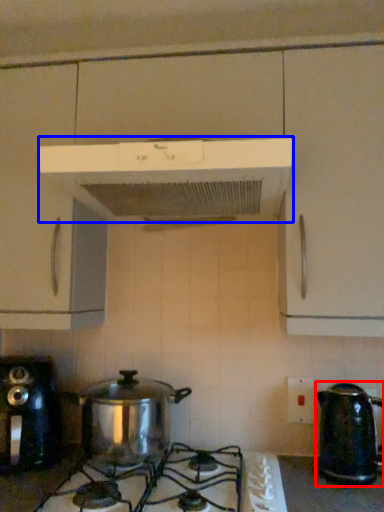
Question: Among these objects, which one is nearest to the camera, kettle (highlighted by a red box) or home appliance (highlighted by a blue box)?

Choices:
 (A) kettle
 (B) home appliance

Answer: (B)